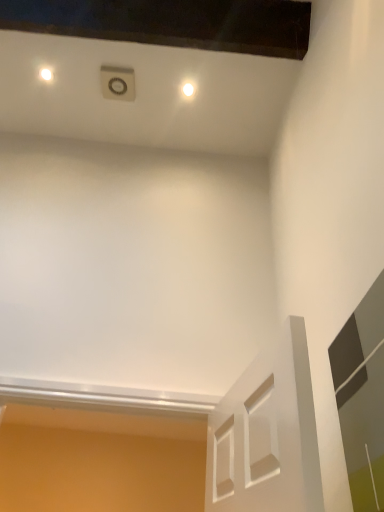
Find the location of a particular element. This screenshot has height=512, width=384. white glossy light at upper center is located at coordinates (188, 89).

The width and height of the screenshot is (384, 512). Describe the element at coordinates (188, 89) in the screenshot. I see `white glossy light at upper center` at that location.

Locate an element on the screen. transparent glass door at right is located at coordinates (362, 397).

The width and height of the screenshot is (384, 512). What do you see at coordinates (362, 397) in the screenshot?
I see `transparent glass door at right` at bounding box center [362, 397].

Where is `white glossy light at upper center`? white glossy light at upper center is located at coordinates (188, 89).

Based on the photo, based on their positions, is white glossy light at upper center located to the left or right of transparent glass door at right?

white glossy light at upper center is to the left of transparent glass door at right.

Does white glossy light at upper center lie in front of transparent glass door at right?

No, it is not.

Is point (185, 86) more distant than point (368, 351)?

Yes, it is behind point (368, 351).

From the image's perspective, is white glossy light at upper center above or below transparent glass door at right?

Clearly, from the image's perspective, white glossy light at upper center is above transparent glass door at right.

From a real-world perspective, is white glossy light at upper center physically below transparent glass door at right?

Incorrect, from a real-world perspective, white glossy light at upper center is higher than transparent glass door at right.

Which object is wider, white glossy light at upper center or transparent glass door at right?

With larger width is white glossy light at upper center.

Consider the image. Which of these two, white glossy light at upper center or transparent glass door at right, stands taller?

With more height is transparent glass door at right.

Looking at the image, does white glossy light at upper center seem bigger or smaller compared to transparent glass door at right?

Considering their sizes, white glossy light at upper center takes up less space than transparent glass door at right.

Is transparent glass door at right a part of white glossy light at upper center?

Actually, transparent glass door at right is outside white glossy light at upper center.

Is there a large distance between white glossy light at upper center and transparent glass door at right?

Indeed, white glossy light at upper center is not near transparent glass door at right.

Consider the image. Is white glossy light at upper center aimed at transparent glass door at right?

No, white glossy light at upper center is not facing towards transparent glass door at right.

Image resolution: width=384 pixels, height=512 pixels. In order to click on dot that appears on the left of transparent glass door at right in this screenshot , I will do click(188, 89).

In the scene shown: Which is more to the right, transparent glass door at right or white glossy light at upper center?

transparent glass door at right is more to the right.

Is transparent glass door at right closer to camera compared to white glossy light at upper center?

Yes, it is in front of white glossy light at upper center.

Between point (363, 341) and point (186, 95), which one is positioned in front?

The point (363, 341) is closer to the camera.

From the image's perspective, which is below, transparent glass door at right or white glossy light at upper center?

From the image's view, transparent glass door at right is below.

Consider the image. From a real-world perspective, which is physically above, transparent glass door at right or white glossy light at upper center?

white glossy light at upper center.

Between transparent glass door at right and white glossy light at upper center, which one has smaller width?

transparent glass door at right.

Looking at this image, can you confirm if transparent glass door at right is shorter than white glossy light at upper center?

No, transparent glass door at right is not shorter than white glossy light at upper center.

Does transparent glass door at right have a smaller size compared to white glossy light at upper center?

No, transparent glass door at right is not smaller than white glossy light at upper center.

Is white glossy light at upper center surrounded by transparent glass door at right?

No, white glossy light at upper center is not a part of transparent glass door at right.

Is transparent glass door at right not close to white glossy light at upper center?

Yes.

Is transparent glass door at right facing towards white glossy light at upper center?

No, transparent glass door at right does not turn towards white glossy light at upper center.

Looking at this image, what's the angular difference between transparent glass door at right and white glossy light at upper center's facing directions?

The angle between the facing direction of transparent glass door at right and the facing direction of white glossy light at upper center is 88.9 degrees.

The width and height of the screenshot is (384, 512). In order to click on glass door that is under the white glossy light at upper center (from a real-world perspective) in this screenshot , I will do `click(362, 397)`.

The image size is (384, 512). I want to click on glass door below the white glossy light at upper center (from a real-world perspective), so click(x=362, y=397).

At what (x,y) coordinates should I click in order to perform the action: click on glass door located in front of the white glossy light at upper center. Please return your answer as a coordinate pair (x, y). Looking at the image, I should click on (362, 397).